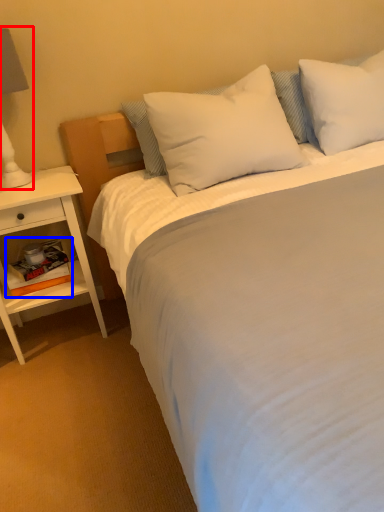
Question: Which object is further to the camera taking this photo, bedside lamp (highlighted by a red box) or book (highlighted by a blue box)?

Choices:
 (A) bedside lamp
 (B) book

Answer: (B)